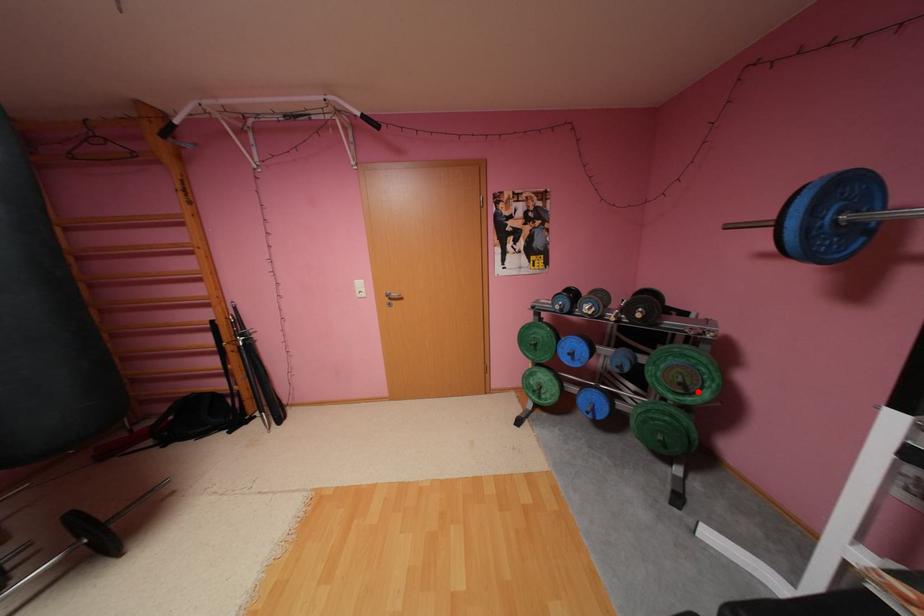
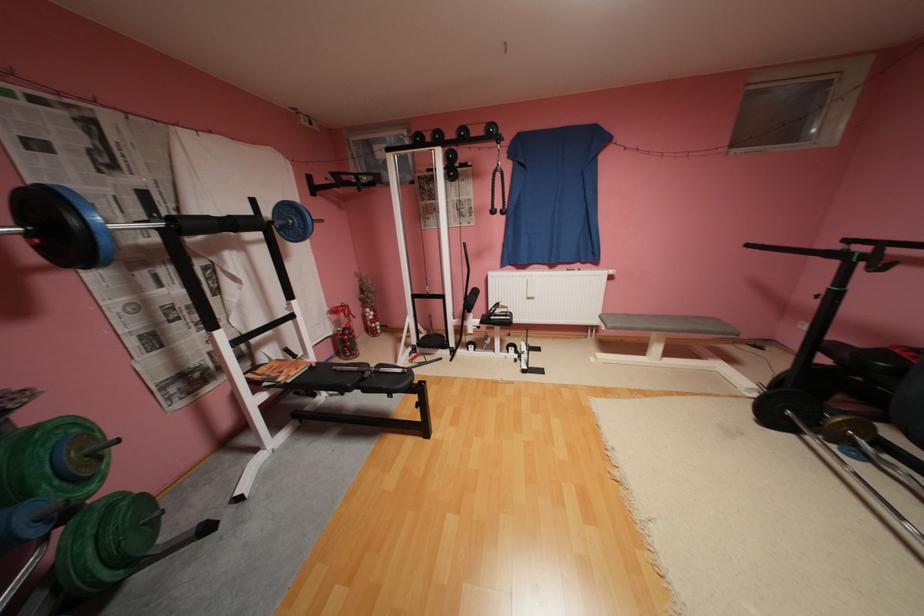
Where in the second image is the point corresponding to the highlighted location from the first image?

(111, 459)